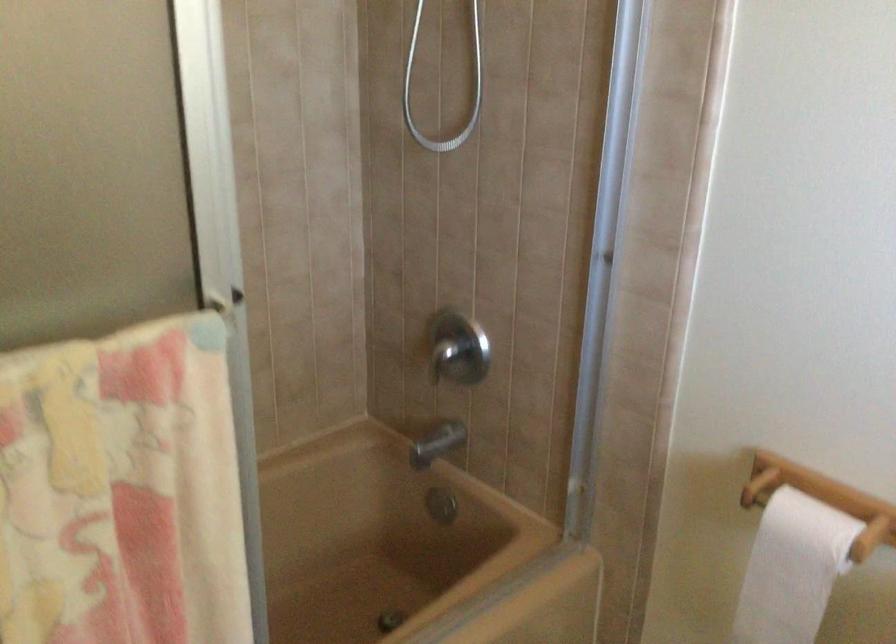
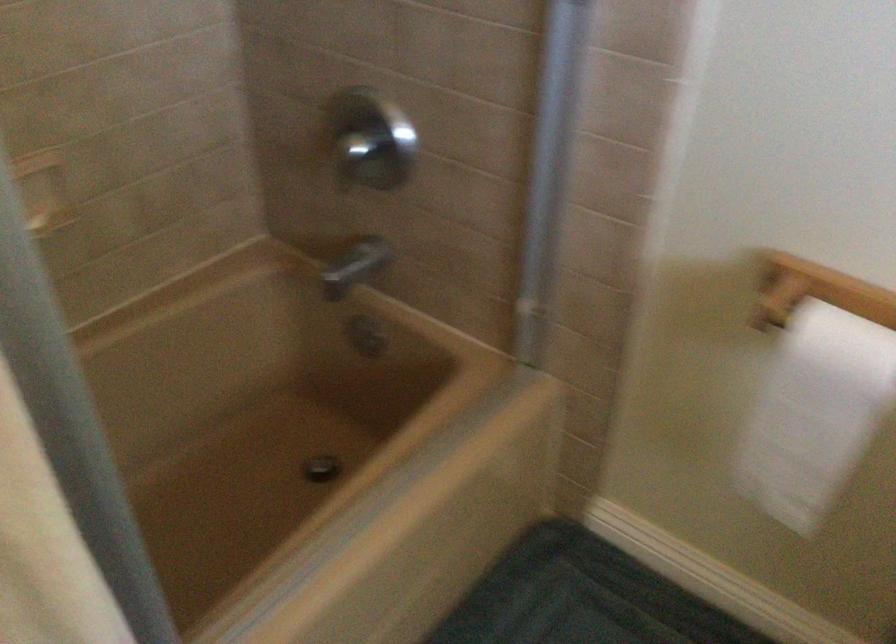
Question: Which direction would the cameraman need to move to produce the second image? Reply with the corresponding letter.

Choices:
 (A) Left
 (B) Right
 (C) Forward
 (D) Backward

Answer: (C)